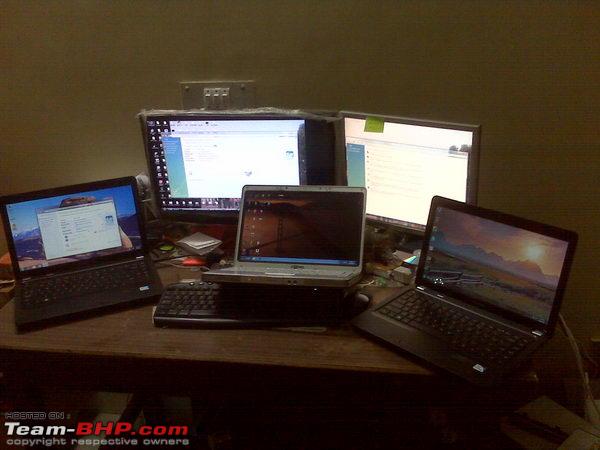
Locate an element on the screen. The width and height of the screenshot is (600, 450). laptop is located at coordinates (497, 291).